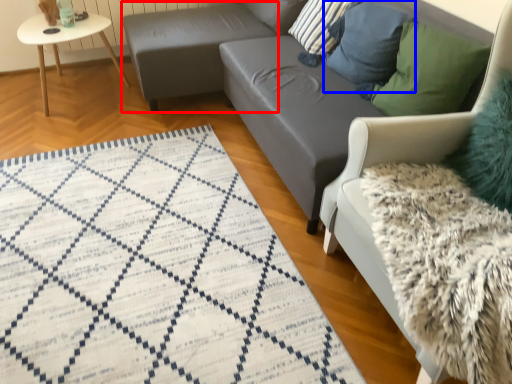
Question: Which of the following is the farthest to the observer, footrest (highlighted by a red box) or pillow (highlighted by a blue box)?

Choices:
 (A) footrest
 (B) pillow

Answer: (A)